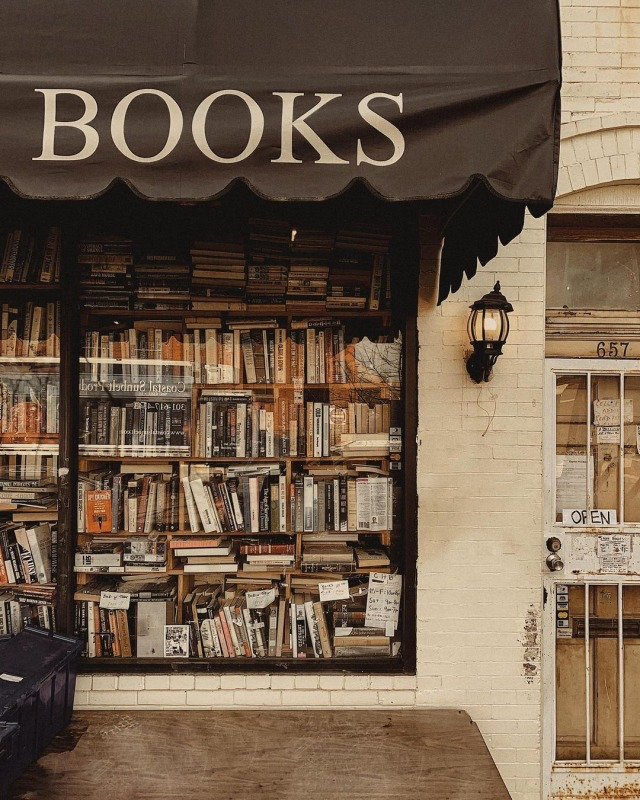
The image size is (640, 800). What are the coordinates of `keyhole` in the screenshot? It's located at (557, 546).